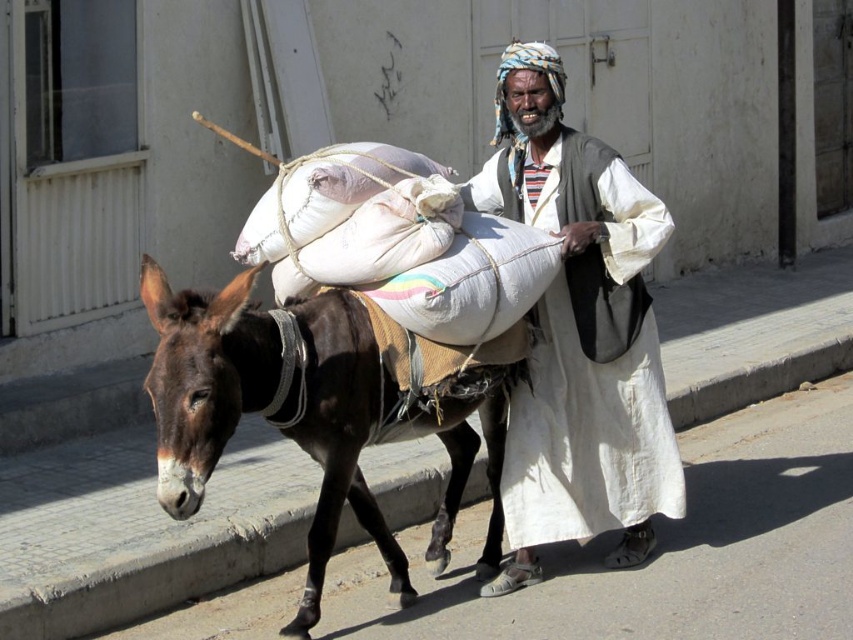
You are a photographer taking a picture of the scene. You need to ensure that both the white cotton dress at center and the brown rough skin mule at center are clearly visible in the frame. Which object should you position closer to the left side of the camera to achieve this?

The brown rough skin mule at center should be positioned closer to the left side of the camera because the white cotton dress at center is to the right of the brown rough skin mule at center, so moving the mule left would keep both in frame.

You are a photographer trying to capture both the white cotton dress at center and the brown rough skin mule at center in a single frame. Given their sizes, which one should you focus on to ensure both are clearly visible in the photo?

The white cotton dress at center is smaller than the brown rough skin mule at center, so you should focus on the brown rough skin mule at center to ensure both are clearly visible in the photo.

You are a fashion designer observing the scene. You need to create a new outfit that complements the style of the white cotton dress at center and the brown rough skin mule at center. Considering their thickness, which material should you prioritize for the new outfit to maintain the balance?

The white cotton dress at center is thinner than the brown rough skin mule at center, so to maintain balance, the new outfit should prioritize a thicker material to complement the mule and offset the thinness of the dress.